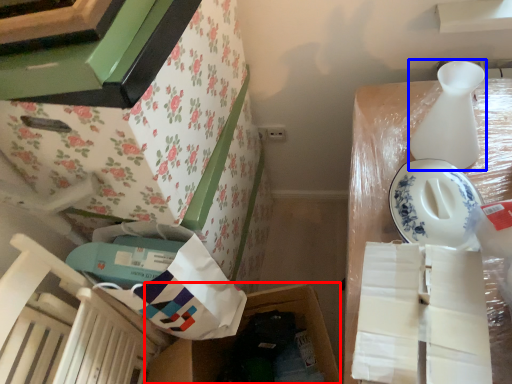
Question: Which of the following is the farthest to the observer, storage box (highlighted by a red box) or vase (highlighted by a blue box)?

Choices:
 (A) storage box
 (B) vase

Answer: (A)